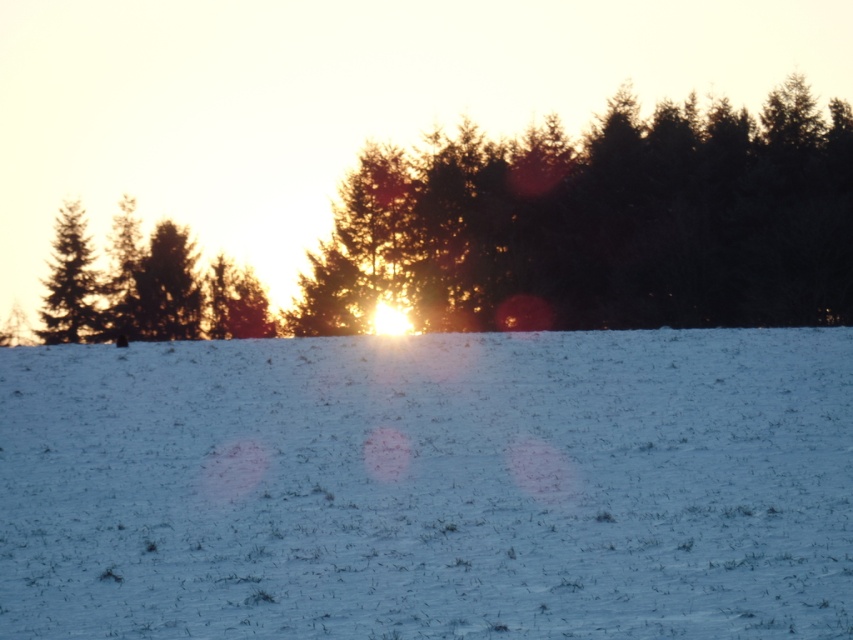
You are standing in the winter landscape and want to place a small red flag exactly at the center of the white matte snow at center. According to the coordinates provided, where should you place the flag?

You should place the small red flag at the coordinates point (430, 486) on the white matte snow at center.

You are an artist trying to paint the winter scene. You have to decide where to place the white matte snow at center and the silvery metallic trees at center. Based on their widths, which object should you make wider in your painting?

The silvery metallic trees at center should be made wider in the painting since the white matte snow at center has a lesser width compared to them.

You are standing in the snow covered field and want to reach the silvery metallic trees at center. According to the coordinates provided, in which direction should you walk from your current position at point 0,0?

The silvery metallic trees at center are located at coordinates point (x=601, y=225). Since you are at point (x=0, y=0), you should walk northeast to reach them.